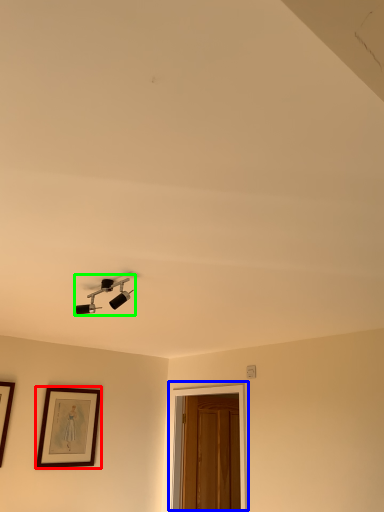
Question: Which object is the farthest from picture frame (highlighted by a red box)? Choose among these: glass door (highlighted by a blue box) or lamp (highlighted by a green box).

Choices:
 (A) glass door
 (B) lamp

Answer: (B)